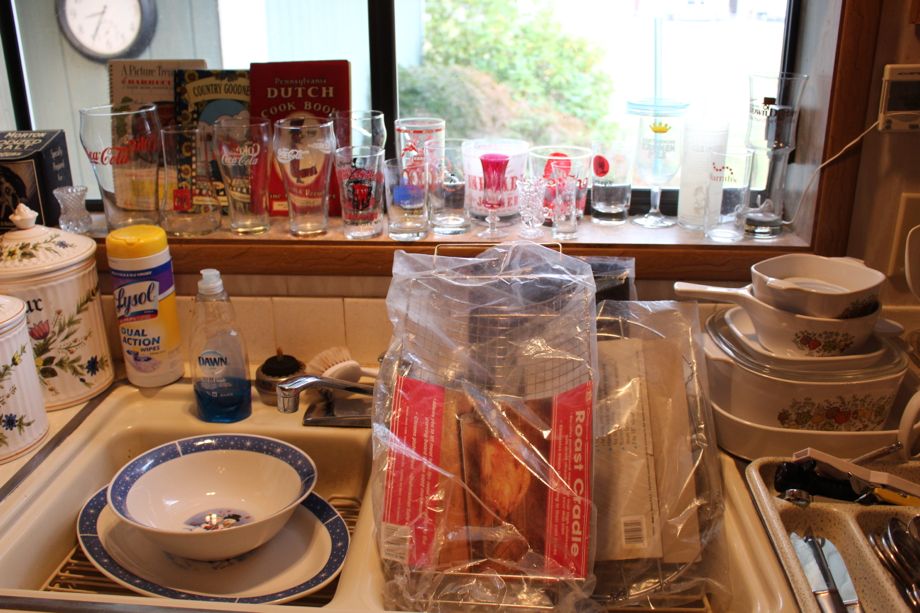
At what (x,y) coordinates should I click in order to perform the action: click on sink. Please return your answer as a coordinate pair (x, y). The height and width of the screenshot is (613, 920). Looking at the image, I should click on (360, 576).